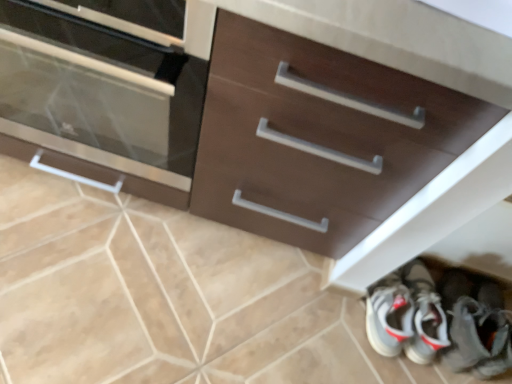
The width and height of the screenshot is (512, 384). I want to click on beige ceramic tile at lower center, so click(x=152, y=293).

The height and width of the screenshot is (384, 512). Describe the element at coordinates (152, 293) in the screenshot. I see `beige ceramic tile at lower center` at that location.

Locate an element on the screen. The height and width of the screenshot is (384, 512). matte brown cabinet at left is located at coordinates (104, 95).

Is beige ceramic tile at lower center next to white leather sneakers at lower right?

beige ceramic tile at lower center and white leather sneakers at lower right are clearly separated.

Between beige ceramic tile at lower center and white leather sneakers at lower right, which one has smaller width?

Thinner between the two is white leather sneakers at lower right.

From the image's perspective, is beige ceramic tile at lower center located above white leather sneakers at lower right?

Yes.

Is white leather sneakers at lower right completely or partially inside beige ceramic tile at lower center?

No, beige ceramic tile at lower center does not contain white leather sneakers at lower right.

Can you confirm if matte brown cabinet at left is bigger than white leather sneakers at lower right?

Indeed, matte brown cabinet at left has a larger size compared to white leather sneakers at lower right.

Considering the positions of objects matte brown cabinet at left and white leather sneakers at lower right in the image provided, who is in front, matte brown cabinet at left or white leather sneakers at lower right?

matte brown cabinet at left is in front.

Looking at this image, is matte brown cabinet at left turned away from white leather sneakers at lower right?

matte brown cabinet at left does not have its back to white leather sneakers at lower right.

Does matte brown cabinet at left appear on the left side of white leather sneakers at lower right?

Yes, matte brown cabinet at left is to the left of white leather sneakers at lower right.

Between point (500, 335) and point (277, 275), which one is positioned in front?

The point (277, 275) is more forward.

Is white leather sneakers at lower right looking in the opposite direction of beige ceramic tile at lower center?

That's not correct — white leather sneakers at lower right is not looking away from beige ceramic tile at lower center.

Is white leather sneakers at lower right inside or outside of beige ceramic tile at lower center?

white leather sneakers at lower right is located beyond the bounds of beige ceramic tile at lower center.

Where is `ceramic tile in front of the white leather sneakers at lower right`? ceramic tile in front of the white leather sneakers at lower right is located at coordinates (152, 293).

Where is `chest of drawers above the beige ceramic tile at lower center (from a real-world perspective)`? chest of drawers above the beige ceramic tile at lower center (from a real-world perspective) is located at coordinates (104, 95).

Considering the points (85, 299) and (42, 100), which point is behind, point (85, 299) or point (42, 100)?

Point (85, 299)

Based on the photo, considering the sizes of objects beige ceramic tile at lower center and matte brown cabinet at left in the image provided, who is smaller, beige ceramic tile at lower center or matte brown cabinet at left?

With smaller size is beige ceramic tile at lower center.

Looking at this image, is the surface of matte brown cabinet at left in direct contact with beige ceramic tile at lower center?

No, matte brown cabinet at left is not next to beige ceramic tile at lower center.

Based on the photo, is beige ceramic tile at lower center completely or partially inside matte brown cabinet at left?

No, beige ceramic tile at lower center is located outside of matte brown cabinet at left.

How different are the orientations of matte brown cabinet at left and beige ceramic tile at lower center in degrees?

There is a 0.269-degree angle between the facing directions of matte brown cabinet at left and beige ceramic tile at lower center.

Which is further, (111,77) or (215,300)?

Positioned behind is point (215,300).

Between point (447, 359) and point (190, 86), which one is positioned behind?

The point (447, 359) is behind.

Would you say matte brown cabinet at left is part of white leather sneakers at lower right's contents?

That's incorrect, matte brown cabinet at left is not inside white leather sneakers at lower right.

From a real-world perspective, who is located higher, white leather sneakers at lower right or matte brown cabinet at left?

From a 3D spatial view, matte brown cabinet at left is above.

Can you confirm if white leather sneakers at lower right is bigger than matte brown cabinet at left?

Actually, white leather sneakers at lower right might be smaller than matte brown cabinet at left.

Identify the location of footwear that appears above the beige ceramic tile at lower center (from a real-world perspective). The width and height of the screenshot is (512, 384). (476, 325).

You are a GUI agent. You are given a task and a screenshot of the screen. Output one action in this format:
    pyautogui.click(x=<x>, y=<y>)
    Task: Click on the footwear below the matte brown cabinet at left (from a real-world perspective)
    Image resolution: width=512 pixels, height=384 pixels.
    Given the screenshot: What is the action you would take?
    pyautogui.click(x=476, y=325)

Estimate the real-world distances between objects in this image. Which object is further from matte brown cabinet at left, beige ceramic tile at lower center or white leather sneakers at lower right?

The object further to matte brown cabinet at left is white leather sneakers at lower right.

In the scene shown: From the image, which object appears to be farther from matte brown cabinet at left, white leather sneakers at lower right or beige ceramic tile at lower center?

Result: white leather sneakers at lower right.

Estimate the real-world distances between objects in this image. Which object is further from white leather sneakers at lower right, matte brown cabinet at left or beige ceramic tile at lower center?

Based on the image, matte brown cabinet at left appears to be further to white leather sneakers at lower right.

Based on their spatial positions, is matte brown cabinet at left or white leather sneakers at lower right closer to beige ceramic tile at lower center?

matte brown cabinet at left lies closer to beige ceramic tile at lower center than the other object.

From the image, which object appears to be farther from white leather sneakers at lower right, beige ceramic tile at lower center or matte brown cabinet at left?

matte brown cabinet at left is positioned further to the anchor white leather sneakers at lower right.

Based on the photo, when comparing their distances from beige ceramic tile at lower center, does white leather sneakers at lower right or matte brown cabinet at left seem closer?

matte brown cabinet at left is positioned closer to the anchor beige ceramic tile at lower center.

Identify the location of ceramic tile situated between matte brown cabinet at left and white leather sneakers at lower right from left to right. Image resolution: width=512 pixels, height=384 pixels. (152, 293).